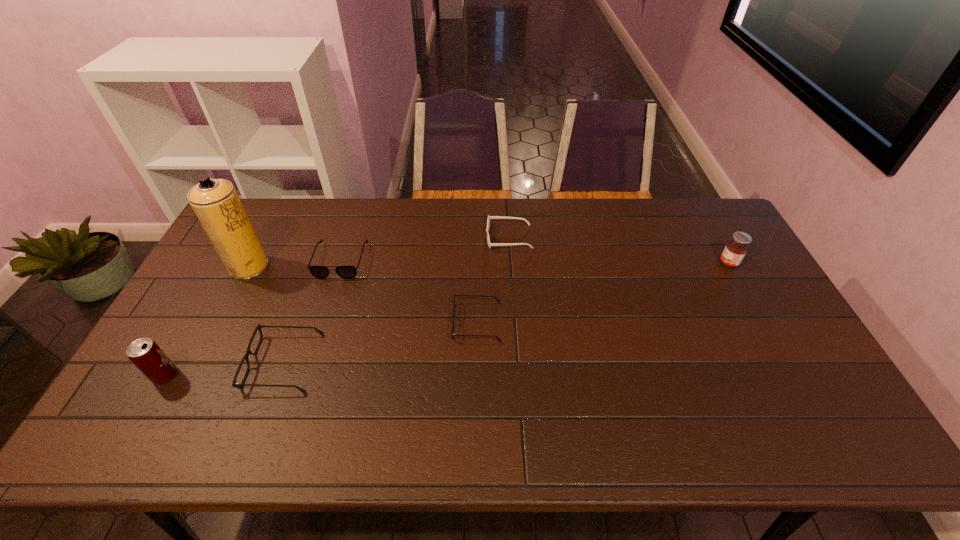
This screenshot has height=540, width=960. What are the coordinates of `spectacles that is at the near edge` in the screenshot? It's located at (234, 384).

Image resolution: width=960 pixels, height=540 pixels. What are the coordinates of `beer can situated at the near edge` in the screenshot? It's located at (144, 353).

Find the location of a particular element. The image size is (960, 540). aerosol can located at the left edge is located at coordinates (215, 202).

The height and width of the screenshot is (540, 960). In order to click on beer can situated at the left edge in this screenshot , I will do `click(144, 353)`.

Where is `object at the right edge`? Image resolution: width=960 pixels, height=540 pixels. object at the right edge is located at coordinates 735,250.

Find the location of `object positioned at the near left corner`. object positioned at the near left corner is located at coordinates (144, 353).

The height and width of the screenshot is (540, 960). What are the coordinates of `vacant space at the far edge` in the screenshot? It's located at (368, 226).

In the image, there is a desktop. Where is `vacant space at the near edge`? This screenshot has width=960, height=540. vacant space at the near edge is located at coordinates (304, 400).

Where is `free point at the left edge`? The width and height of the screenshot is (960, 540). free point at the left edge is located at coordinates (207, 342).

Locate an element on the screen. Image resolution: width=960 pixels, height=540 pixels. vacant space at the right edge of the desktop is located at coordinates (725, 274).